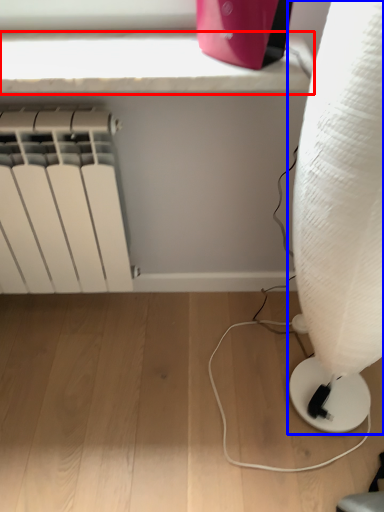
Question: Which object is closer to the camera taking this photo, window sill (highlighted by a red box) or lamp (highlighted by a blue box)?

Choices:
 (A) window sill
 (B) lamp

Answer: (B)